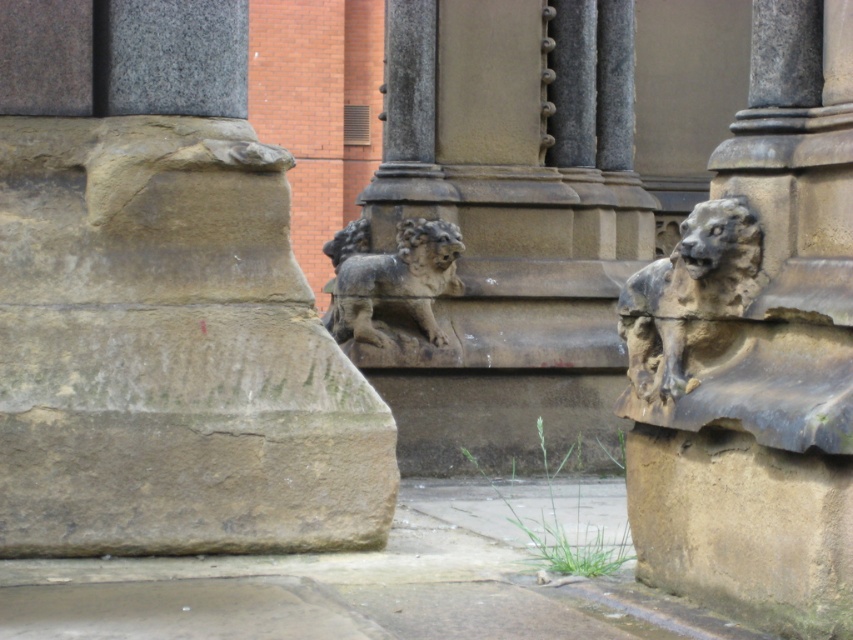
Question: Which of the following is the closest to the observer?

Choices:
 (A) gray stone lion at center
 (B) rough stone gargoyle at center
 (C) weathered stone lion at right

Answer: (B)

Question: Which point is farther to the camera?

Choices:
 (A) rough stone gargoyle at center
 (B) brown stone lion at left
 (C) weathered stone lion at right

Answer: (B)

Question: Among these points, which one is nearest to the camera?

Choices:
 (A) (370, 282)
 (B) (10, 144)
 (C) (792, 422)
 (D) (741, 285)

Answer: (C)

Question: Does weathered stone lion at right have a lesser width compared to gray stone lion at center?

Choices:
 (A) yes
 (B) no

Answer: (A)

Question: Where is rough stone gargoyle at center located in relation to gray stone lion at center in the image?

Choices:
 (A) above
 (B) below

Answer: (B)

Question: Does rough stone gargoyle at center lie in front of weathered stone lion at right?

Choices:
 (A) yes
 (B) no

Answer: (A)